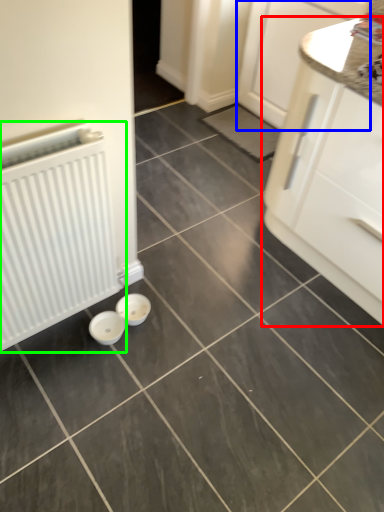
Question: Which object is positioned farthest from cabinetry (highlighted by a red box)? Select from cabinetry (highlighted by a blue box) and radiator (highlighted by a green box).

Choices:
 (A) cabinetry
 (B) radiator

Answer: (B)